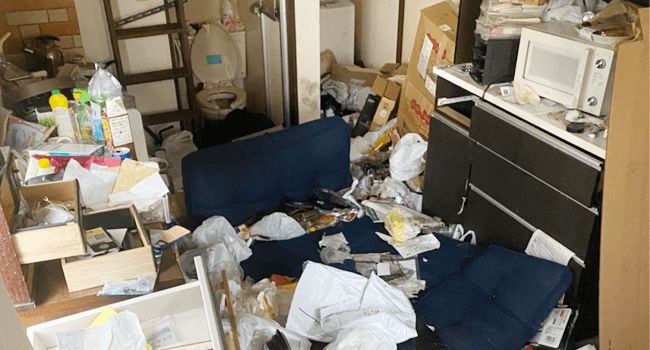
Identify the location of blue cushions on floor. The image size is (650, 350). (255, 164).